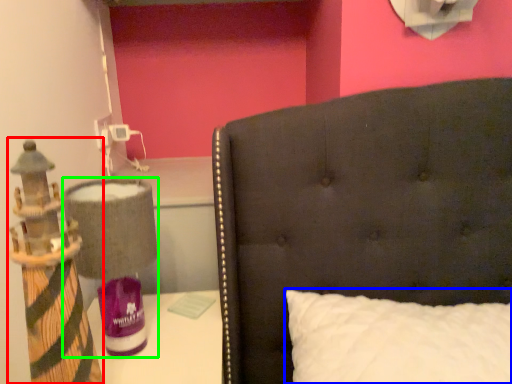
Question: Which is nearer to the toy (highlighted by a red box)? pillow (highlighted by a blue box) or table lamp (highlighted by a green box).

Choices:
 (A) pillow
 (B) table lamp

Answer: (B)